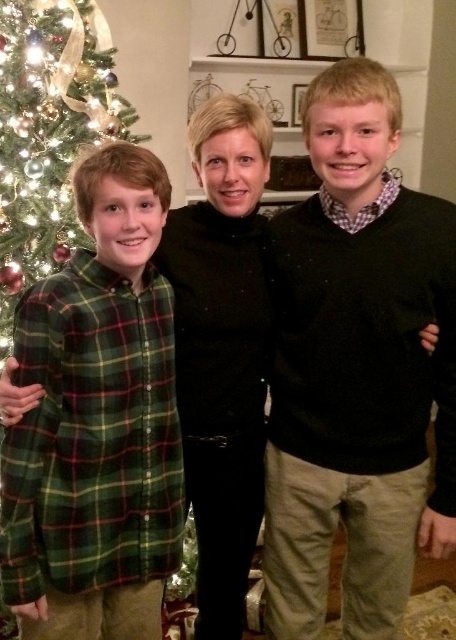
Does matte black sweater at center have a lesser width compared to green plaid shirt at left?

In fact, matte black sweater at center might be wider than green plaid shirt at left.

Can you confirm if matte black sweater at center is smaller than green plaid shirt at left?

No.

Does point (336, 352) come farther from viewer compared to point (89, 323)?

Yes, point (336, 352) is farther from viewer.

This screenshot has width=456, height=640. I want to click on matte black sweater at center, so click(x=357, y=369).

Where is `matte black sweater at center`? matte black sweater at center is located at coordinates (357, 369).

At what (x,y) coordinates should I click in order to perform the action: click on matte black sweater at center. Please return your answer as a coordinate pair (x, y). Looking at the image, I should click on (357, 369).

In the scene shown: Who is shorter, green plaid shirt at left or green matte christmas tree at left?

Standing shorter between the two is green matte christmas tree at left.

Can you confirm if green plaid shirt at left is positioned to the left of green matte christmas tree at left?

In fact, green plaid shirt at left is to the right of green matte christmas tree at left.

Measure the distance between point [102,573] and camera.

A distance of 4.20 feet exists between point [102,573] and camera.

You are a GUI agent. You are given a task and a screenshot of the screen. Output one action in this format:
    pyautogui.click(x=<x>, y=<y>)
    Task: Click on the green plaid shirt at left
    The width and height of the screenshot is (456, 640).
    Given the screenshot: What is the action you would take?
    (97, 420)